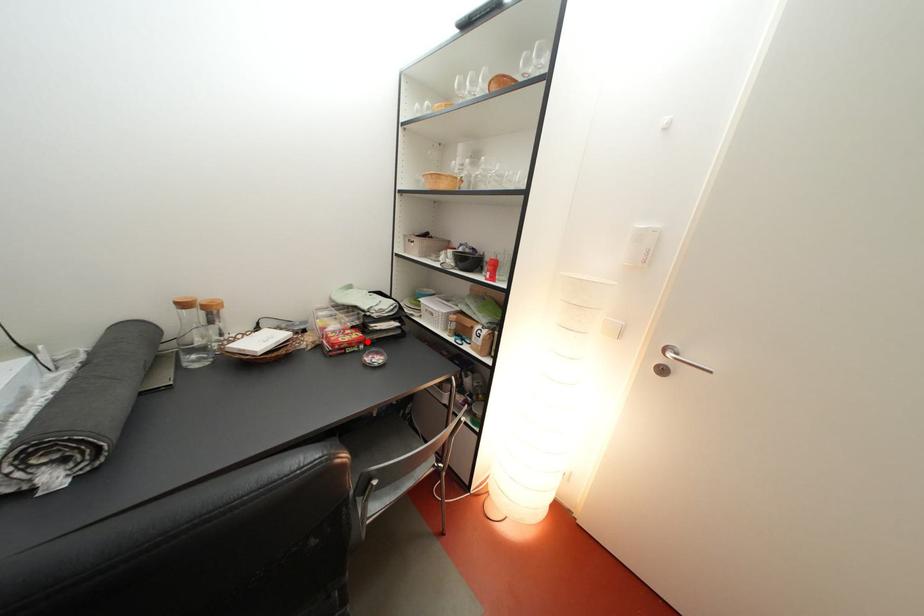
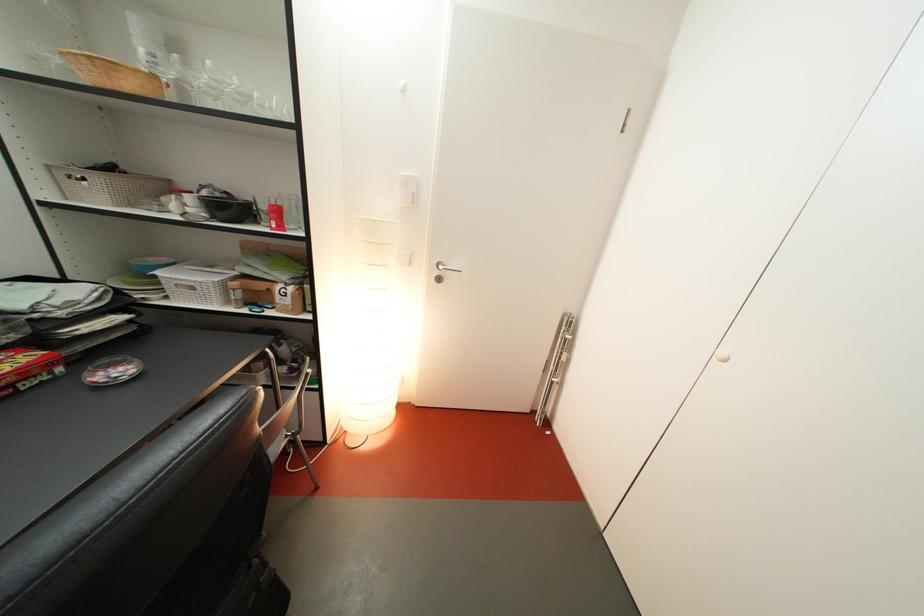
The point at the highlighted location is marked in the first image. Where is the corresponding point in the second image?

(38, 363)